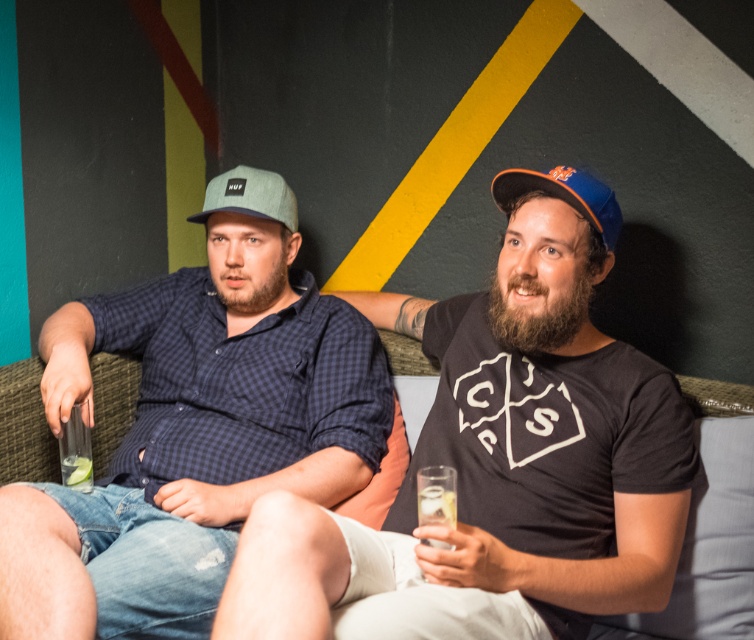
Question: Is matte blue shirt at left positioned at the back of blue fabric baseball cap at right?

Choices:
 (A) yes
 (B) no

Answer: (B)

Question: Which of the following is the closest to the observer?

Choices:
 (A) (74, 472)
 (B) (566, 186)

Answer: (B)

Question: Does matte blue cap at center appear over clear glass at lower left?

Choices:
 (A) yes
 (B) no

Answer: (A)

Question: Which point appears closest to the camera in this image?

Choices:
 (A) (566, 189)
 (B) (86, 435)

Answer: (A)

Question: Does matte blue shirt at left have a greater width compared to green fabric couch at center?

Choices:
 (A) yes
 (B) no

Answer: (A)

Question: Estimate the real-world distances between objects in this image. Which object is farther from the matte blue shirt at left?

Choices:
 (A) blue fabric baseball cap at right
 (B) matte green baseball cap at center

Answer: (A)